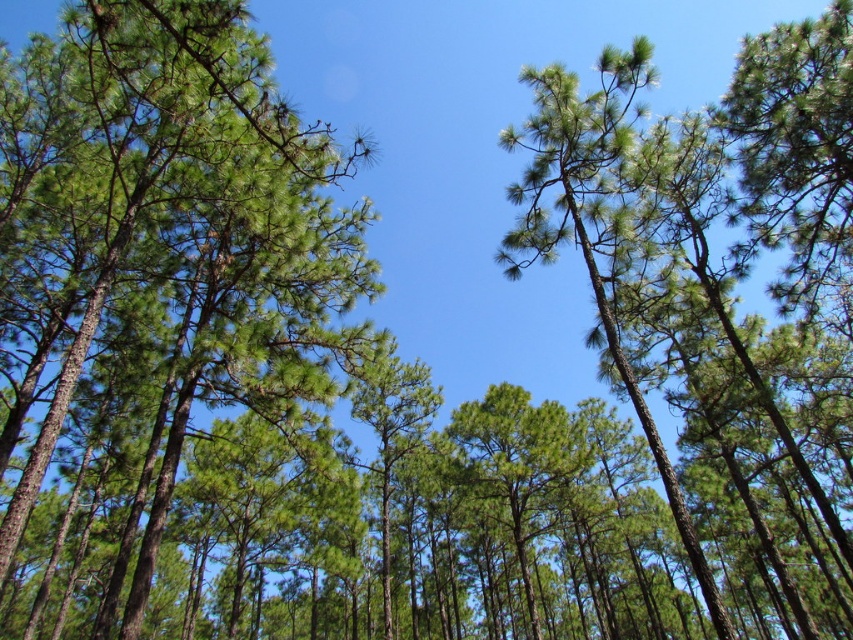
Looking up at the dense pine forest canopy, you notice a specific point marked at coordinates (160, 259). What type of foliage is located exactly at that point?

The point at (160, 259) has green needle like foliage.